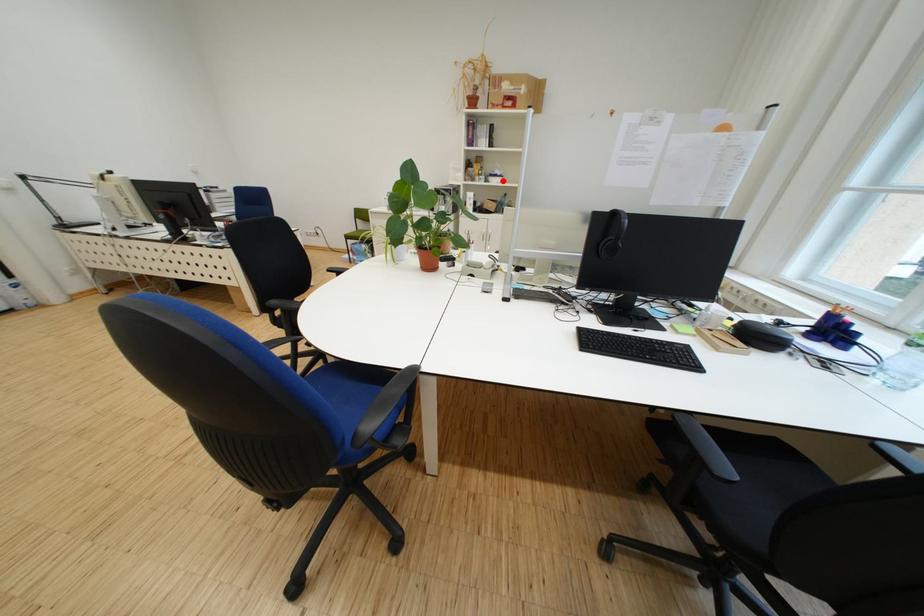
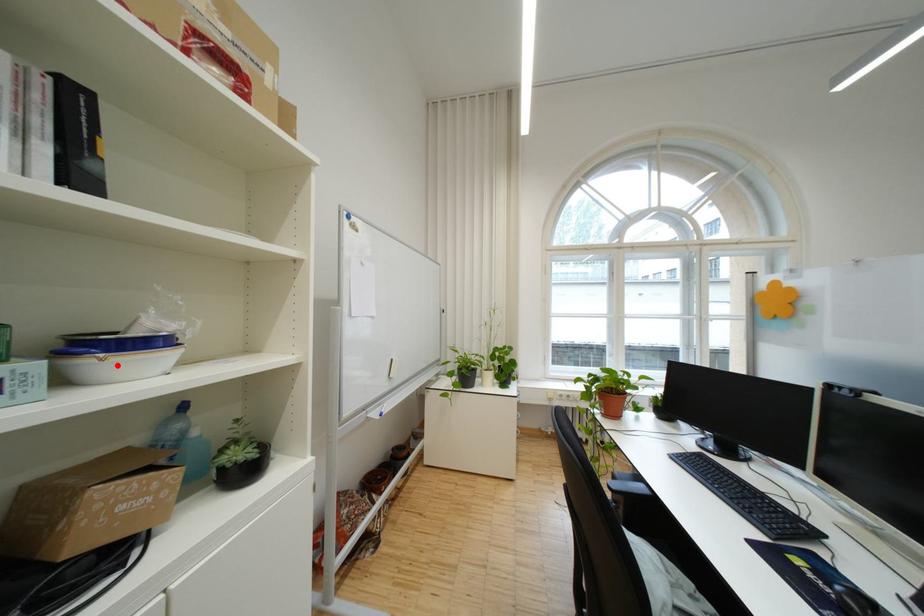
I am providing you with two images of the same scene from different viewpoints. A red point is marked on the first image and another point is marked on the second image. Do the highlighted points in image1 and image2 indicate the same real-world spot?

Yes